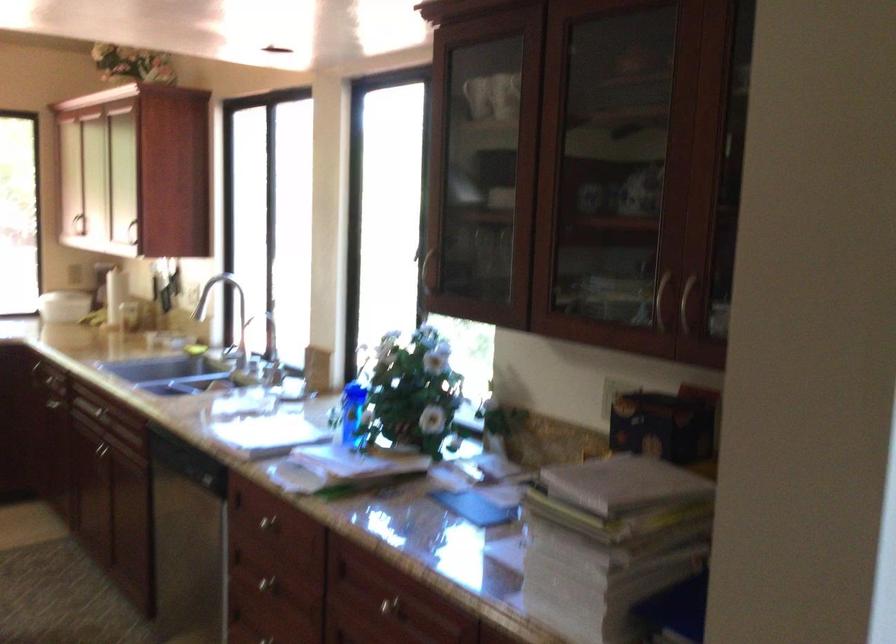
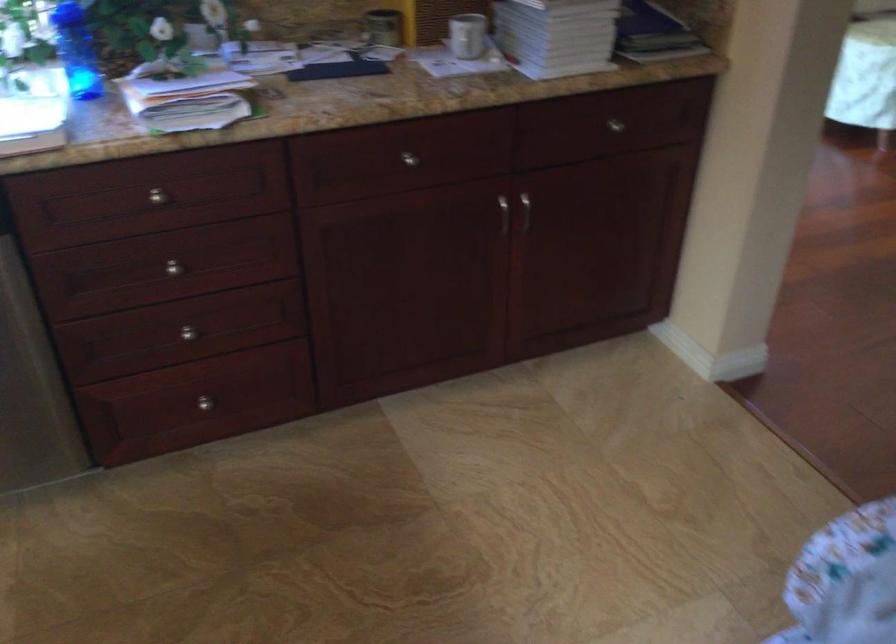
Locate, in the second image, the point that corresponds to (255,520) in the first image.

(156, 196)